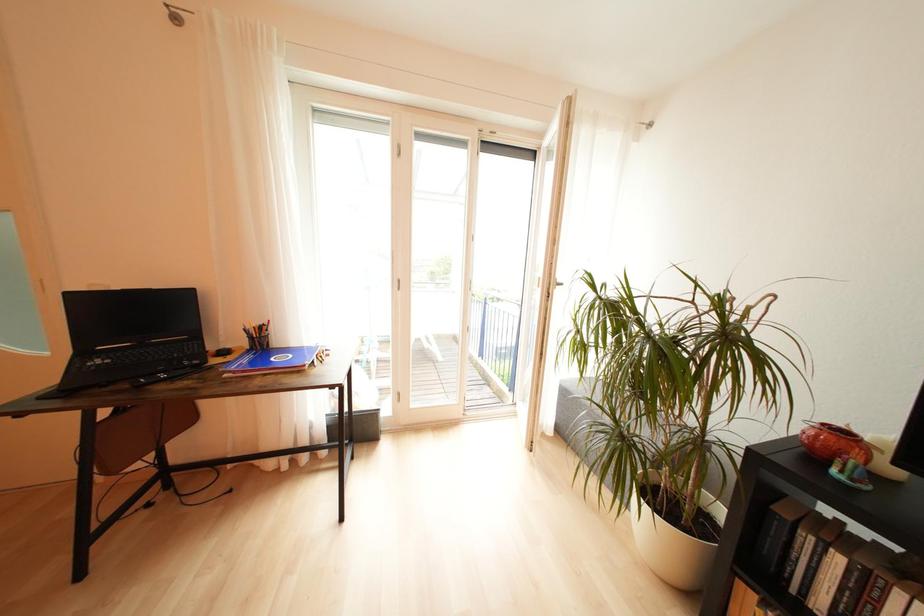
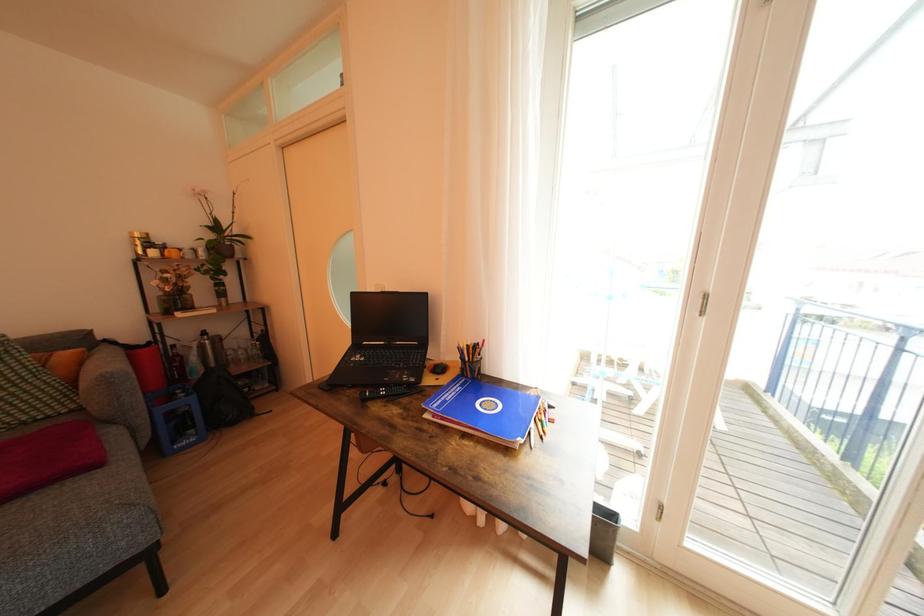
Question: The first image is from the beginning of the video and the second image is from the end. How did the camera likely rotate when shooting the video?

Choices:
 (A) Left
 (B) Right
 (C) Up
 (D) Down

Answer: (A)